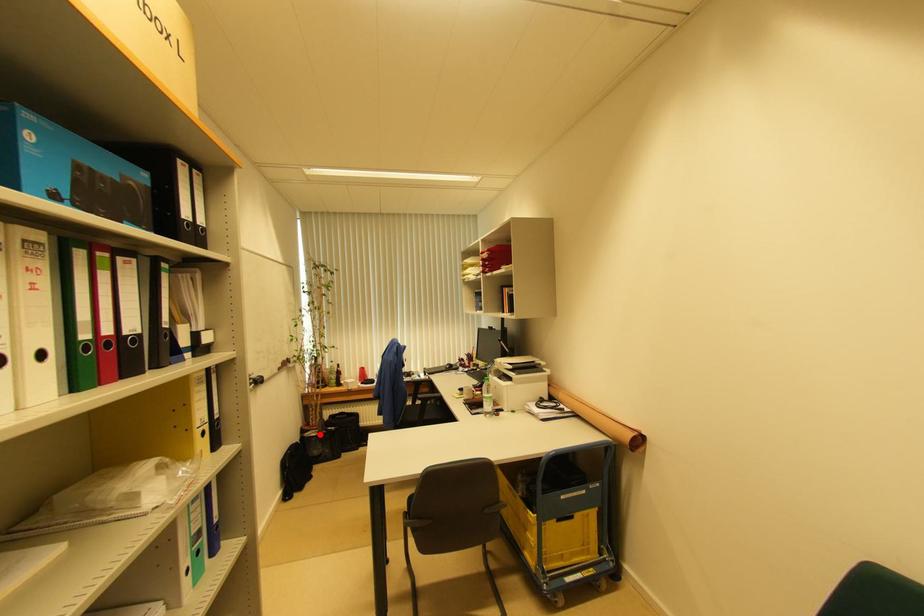
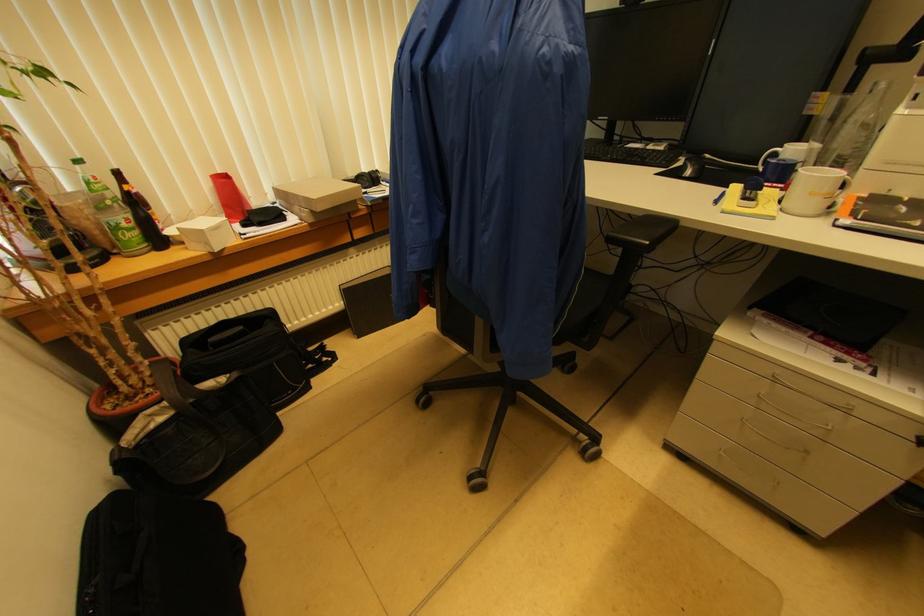
Question: I am providing you with two images of the same scene from different viewpoints. Image1 has a red point marked. In image2, the corresponding 3D location appears at what relative position? Reply with the corresponding letter.

Choices:
 (A) Closer
 (B) Farther

Answer: (A)